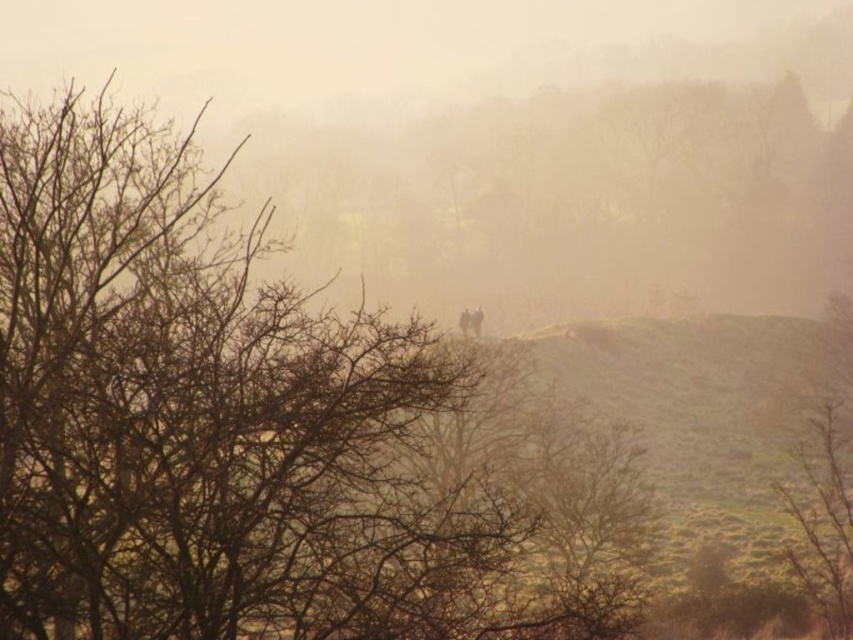
You are a hiker trying to navigate through the misty landscape. You see the brown leafless tree at center and the foggy atmosphere at center. Which object is closer to you?

The brown leafless tree at center is closer to you because it is positioned on the left side of the foggy atmosphere at center, which is further away.

You are an artist trying to paint the scene. You want to ensure the foggy atmosphere at center and brown matte tree at right are proportionally accurate. Which object should you make wider in your painting?

The foggy atmosphere at center should be made wider in the painting since its width is larger than the brown matte tree at right.